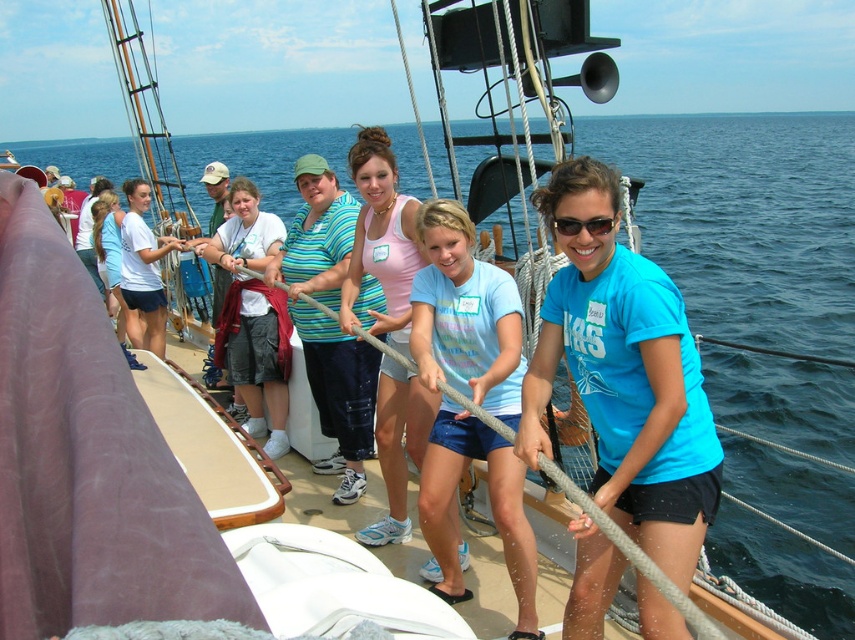
Question: Does light blue t-shirt at center appear under matte pink tank top at center?

Choices:
 (A) yes
 (B) no

Answer: (A)

Question: Is blue cotton shirt at center bigger than light blue t-shirt at center?

Choices:
 (A) yes
 (B) no

Answer: (A)

Question: Among these objects, which one is farthest from the camera?

Choices:
 (A) blue cotton shirt at center
 (B) light blue t-shirt at center

Answer: (B)

Question: Among these objects, which one is farthest from the camera?

Choices:
 (A) matte pink tank top at center
 (B) striped cotton shirt at center
 (C) blue cotton shirt at center
 (D) light blue t-shirt at center

Answer: (B)

Question: Which point appears farthest from the camera in this image?

Choices:
 (A) (317, 394)
 (B) (624, 378)
 (C) (503, 474)

Answer: (A)

Question: Is striped cotton shirt at center positioned behind matte pink tank top at center?

Choices:
 (A) no
 (B) yes

Answer: (B)